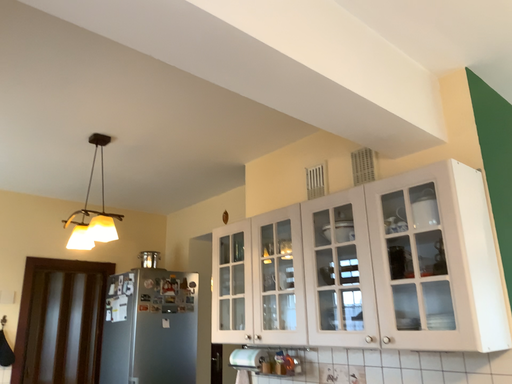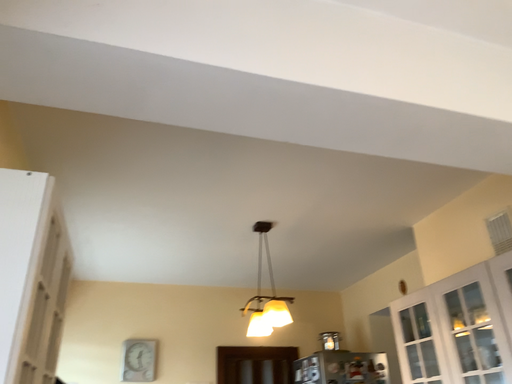
Question: Which way did the camera rotate in the video?

Choices:
 (A) rotated right
 (B) rotated left

Answer: (B)